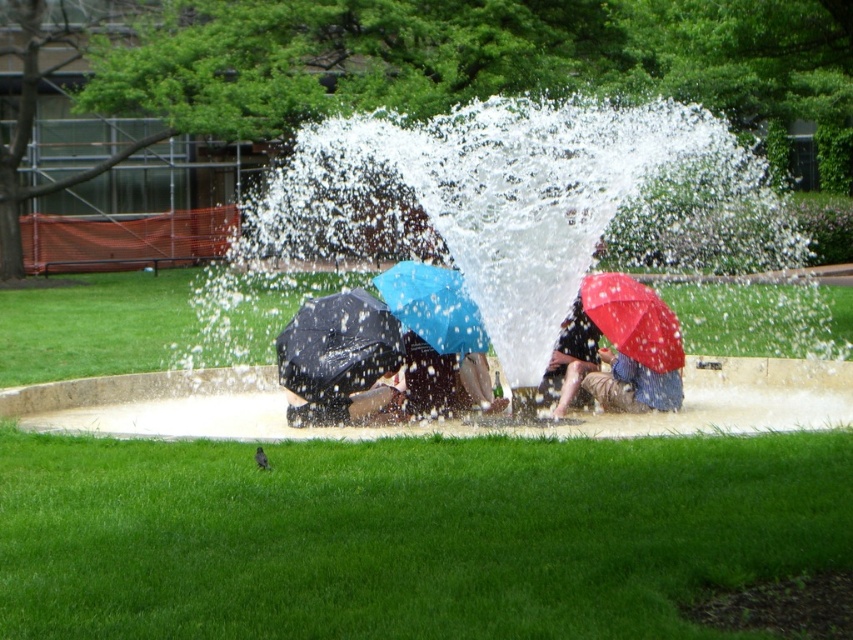
Question: Does white frothy water at center have a larger size compared to matte black umbrella at center?

Choices:
 (A) no
 (B) yes

Answer: (B)

Question: Which object is the farthest from the blue matte umbrella at center?

Choices:
 (A) matte black umbrella at center
 (B) white frothy water at center
 (C) red matte umbrella at center
 (D) matte red umbrella at center

Answer: (B)

Question: Does red matte umbrella at center appear under matte red umbrella at center?

Choices:
 (A) no
 (B) yes

Answer: (A)

Question: Is blue matte umbrella at center wider than matte red umbrella at center?

Choices:
 (A) no
 (B) yes

Answer: (B)

Question: Which of these objects is positioned closest to the matte black umbrella at center?

Choices:
 (A) white frothy water at center
 (B) red matte umbrella at center
 (C) blue matte umbrella at center
 (D) matte red umbrella at center

Answer: (C)

Question: Based on their relative distances, which object is farther from the matte red umbrella at center?

Choices:
 (A) matte black umbrella at center
 (B) white frothy water at center

Answer: (B)